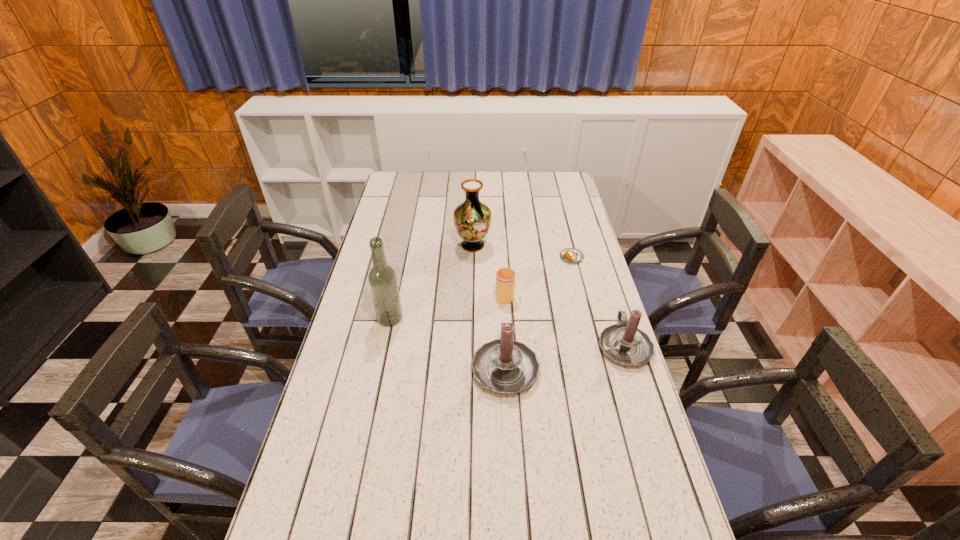
The image size is (960, 540). In order to click on free spot between the shortest object and the third shortest object in this screenshot , I will do `click(598, 302)`.

Locate an element on the screen. This screenshot has height=540, width=960. free point between the shortest object and the liquor is located at coordinates (481, 288).

Identify the location of free spot between the fourth nearest object and the liquor. (447, 307).

This screenshot has width=960, height=540. Find the location of `blank region between the right candle and the cup`. blank region between the right candle and the cup is located at coordinates (564, 321).

Locate an element on the screen. This screenshot has height=540, width=960. vacant area between the shorter candle and the fourth shortest object is located at coordinates (564, 356).

Locate which object ranks third in proximity to the fifth shortest object. Please provide its 2D coordinates. Your answer should be formatted as a tuple, i.e. [(x, y)], where the tuple contains the x and y coordinates of a point satisfying the conditions above.

[(382, 278)]

Locate which object is the fourth closest to the cup. Please provide its 2D coordinates. Your answer should be formatted as a tuple, i.e. [(x, y)], where the tuple contains the x and y coordinates of a point satisfying the conditions above.

[(624, 343)]

Identify the location of vacant space that satisfies the following two spatial constraints: 1. on the side of the left candle with the handle loop; 2. on the left side of the pastry. (499, 258).